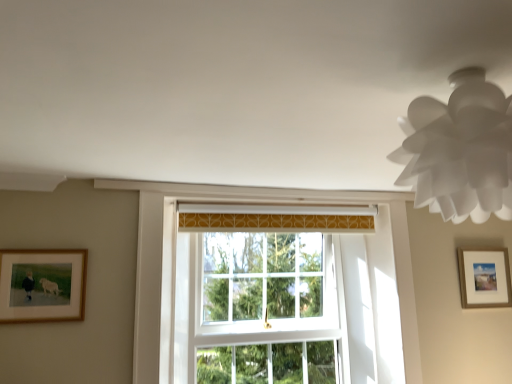
Question: Is white glass window at center looking in the opposite direction of wooden framed picture at left, acting as the second picture frame starting from the back?

Choices:
 (A) no
 (B) yes

Answer: (A)

Question: Is white glass window at center oriented towards wooden framed picture at left, which is the first picture frame in front-to-back order?

Choices:
 (A) no
 (B) yes

Answer: (A)

Question: Considering the relative positions of white glass window at center and wooden framed picture at left, placed as the 2th picture frame when sorted from right to left, in the image provided, is white glass window at center in front of wooden framed picture at left, placed as the 2th picture frame when sorted from right to left,?

Choices:
 (A) no
 (B) yes

Answer: (A)

Question: Does white glass window at center have a greater height compared to wooden framed picture at left, placed as the 2th picture frame when sorted from right to left?

Choices:
 (A) yes
 (B) no

Answer: (A)

Question: Is white glass window at center further to camera compared to wooden framed picture at left, acting as the second picture frame starting from the back?

Choices:
 (A) no
 (B) yes

Answer: (B)

Question: Is white glass window at center with wooden framed picture at left, acting as the 1th picture frame starting from the left?

Choices:
 (A) no
 (B) yes

Answer: (A)

Question: From a real-world perspective, is white paper lampshade at upper right under wooden framed picture at left, acting as the 1th picture frame starting from the left?

Choices:
 (A) yes
 (B) no

Answer: (B)

Question: From the image's perspective, is white paper lampshade at upper right under wooden framed picture at left, acting as the 1th picture frame starting from the left?

Choices:
 (A) no
 (B) yes

Answer: (A)

Question: From the image's perspective, does white paper lampshade at upper right appear higher than wooden framed picture at left, acting as the 1th picture frame starting from the left?

Choices:
 (A) no
 (B) yes

Answer: (B)

Question: Can you see white paper lampshade at upper right touching wooden framed picture at left, acting as the second picture frame starting from the back?

Choices:
 (A) no
 (B) yes

Answer: (A)

Question: Can you confirm if white paper lampshade at upper right is positioned to the left of wooden framed picture at left, acting as the 1th picture frame starting from the left?

Choices:
 (A) no
 (B) yes

Answer: (A)

Question: Is white paper lampshade at upper right oriented away from wooden framed picture at left, acting as the 1th picture frame starting from the left?

Choices:
 (A) no
 (B) yes

Answer: (A)

Question: Considering the relative sizes of wooden framed picture at right, the first picture frame when ordered from back to front, and white paper lampshade at upper right in the image provided, is wooden framed picture at right, the first picture frame when ordered from back to front, bigger than white paper lampshade at upper right?

Choices:
 (A) no
 (B) yes

Answer: (A)